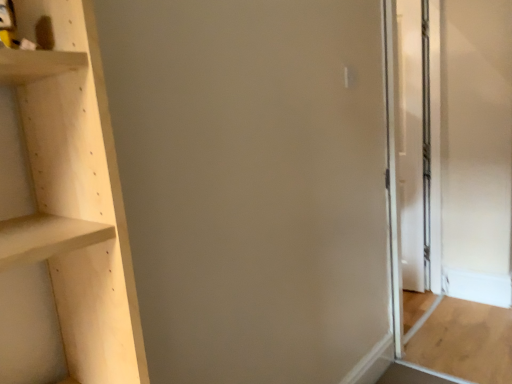
Locate an element on the screen. light brown wood door at right is located at coordinates (465, 341).

This screenshot has width=512, height=384. What do you see at coordinates (465, 341) in the screenshot? I see `light brown wood door at right` at bounding box center [465, 341].

From the picture: What is the approximate height of transparent glass screen door at right?

transparent glass screen door at right is 2.04 meters in height.

You are a GUI agent. You are given a task and a screenshot of the screen. Output one action in this format:
    pyautogui.click(x=<x>, y=<y>)
    Task: Click on the transparent glass screen door at right
    This screenshot has width=512, height=384.
    Given the screenshot: What is the action you would take?
    pyautogui.click(x=416, y=141)

This screenshot has width=512, height=384. What do you see at coordinates (416, 141) in the screenshot?
I see `transparent glass screen door at right` at bounding box center [416, 141].

Locate an element on the screen. light brown wood door at right is located at coordinates point(465,341).

Considering the relative positions of transparent glass screen door at right and light brown wood door at right in the image provided, is transparent glass screen door at right to the left of light brown wood door at right from the viewer's perspective?

Indeed, transparent glass screen door at right is positioned on the left side of light brown wood door at right.

Is transparent glass screen door at right behind light brown wood door at right?

Yes.

Does point (437, 109) come closer to viewer compared to point (466, 326)?

No, (437, 109) is behind (466, 326).

From the image's perspective, is transparent glass screen door at right beneath light brown wood door at right?

No, from the image's perspective, transparent glass screen door at right is not beneath light brown wood door at right.

From a real-world perspective, is transparent glass screen door at right physically above light brown wood door at right?

Yes.

Is transparent glass screen door at right wider or thinner than light brown wood door at right?

Considering their sizes, transparent glass screen door at right looks slimmer than light brown wood door at right.

Who is taller, transparent glass screen door at right or light brown wood door at right?

transparent glass screen door at right is taller.

Between transparent glass screen door at right and light brown wood door at right, which one has smaller size?

light brown wood door at right is smaller.

Is transparent glass screen door at right located outside light brown wood door at right?

Yes, transparent glass screen door at right is not within light brown wood door at right.

Is transparent glass screen door at right far away from light brown wood door at right?

That's not correct — transparent glass screen door at right is a little close to light brown wood door at right.

Could you tell me if transparent glass screen door at right is facing light brown wood door at right?

Yes, transparent glass screen door at right is oriented towards light brown wood door at right.

What's the angular difference between transparent glass screen door at right and light brown wood door at right's facing directions?

There is a 88.2-degree angle between the facing directions of transparent glass screen door at right and light brown wood door at right.

Image resolution: width=512 pixels, height=384 pixels. What are the coordinates of `plywood on the right of transparent glass screen door at right` in the screenshot? It's located at (465, 341).

Can you confirm if light brown wood door at right is positioned to the right of transparent glass screen door at right?

Yes.

Consider the image. Between light brown wood door at right and transparent glass screen door at right, which one is positioned in front?

light brown wood door at right is closer to the camera.

Between point (426, 305) and point (400, 27), which one is positioned in front?

Point (400, 27)

From the image's perspective, which one is positioned higher, light brown wood door at right or transparent glass screen door at right?

transparent glass screen door at right.

From a real-world perspective, does light brown wood door at right sit lower than transparent glass screen door at right?

Yes, from a real-world perspective, light brown wood door at right is beneath transparent glass screen door at right.

Can you confirm if light brown wood door at right is thinner than transparent glass screen door at right?

Incorrect, the width of light brown wood door at right is not less than that of transparent glass screen door at right.

Is light brown wood door at right taller than transparent glass screen door at right?

No.

Can you confirm if light brown wood door at right is smaller than transparent glass screen door at right?

Correct, light brown wood door at right occupies less space than transparent glass screen door at right.

Is light brown wood door at right positioned beyond the bounds of transparent glass screen door at right?

Yes, light brown wood door at right is outside of transparent glass screen door at right.

Can you see light brown wood door at right touching transparent glass screen door at right?

No, light brown wood door at right is not beside transparent glass screen door at right.

Is light brown wood door at right oriented towards transparent glass screen door at right?

No.

Consider the image. How different are the orientations of light brown wood door at right and transparent glass screen door at right in degrees?

They differ by 88.2 degrees in their facing directions.

At what (x,y) coordinates should I click in order to perform the action: click on screen door lying behind the light brown wood door at right. Please return your answer as a coordinate pair (x, y). The height and width of the screenshot is (384, 512). Looking at the image, I should click on (416, 141).

I want to click on screen door that appears on the left of light brown wood door at right, so click(x=416, y=141).

Where is `plywood on the right side of transparent glass screen door at right`? This screenshot has width=512, height=384. plywood on the right side of transparent glass screen door at right is located at coordinates (465, 341).